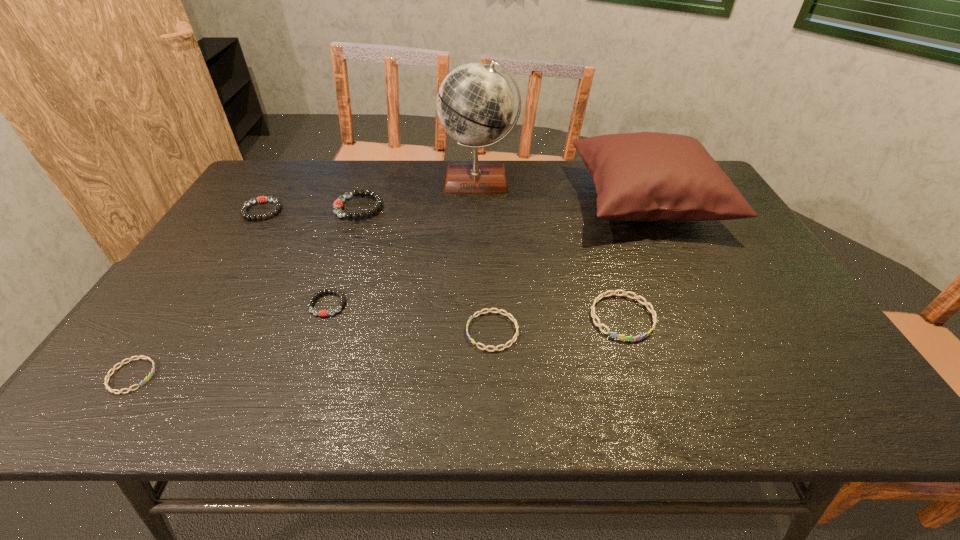
Find the location of a particular element. This screenshot has width=960, height=540. unoccupied area between the tallest bracelet and the smallest black bracelet is located at coordinates (344, 256).

Find the location of `empty location between the globe and the smallest black bracelet`. empty location between the globe and the smallest black bracelet is located at coordinates (403, 242).

Select which object appears as the third closest to the nearest black bracelet. Please provide its 2D coordinates. Your answer should be formatted as a tuple, i.e. [(x, y)], where the tuple contains the x and y coordinates of a point satisfying the conditions above.

[(337, 207)]

Identify which object is located as the third nearest to the sixth shortest object. Please provide its 2D coordinates. Your answer should be formatted as a tuple, i.e. [(x, y)], where the tuple contains the x and y coordinates of a point satisfying the conditions above.

[(322, 313)]

Locate an element on the screen. bracelet that is the nearest to the globe is located at coordinates pos(337,207).

Locate an element on the screen. bracelet that stands as the third closest to the second tallest object is located at coordinates (337, 207).

Select which black bracelet appears as the third closest to the seventh shortest object. Please provide its 2D coordinates. Your answer should be formatted as a tuple, i.e. [(x, y)], where the tuple contains the x and y coordinates of a point satisfying the conditions above.

[(262, 199)]

At what (x,y) coordinates should I click in order to perform the action: click on the third closest black bracelet to the second tallest object. Please return your answer as a coordinate pair (x, y). Looking at the image, I should click on (262, 199).

Locate which blue bracelet ranks second in proximity to the nearest object. Please provide its 2D coordinates. Your answer should be formatted as a tuple, i.e. [(x, y)], where the tuple contains the x and y coordinates of a point satisfying the conditions above.

[(614, 334)]

In order to click on the second closest blue bracelet relative to the biggest blue bracelet in this screenshot , I will do `click(146, 379)`.